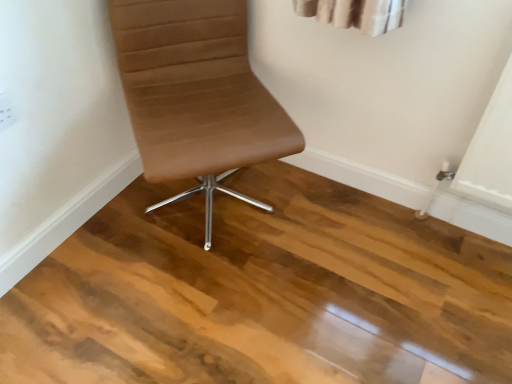
Image resolution: width=512 pixels, height=384 pixels. What do you see at coordinates (196, 94) in the screenshot?
I see `brown leather chair at center` at bounding box center [196, 94].

At what (x,y) coordinates should I click in order to perform the action: click on brown leather chair at center. Please return your answer as a coordinate pair (x, y). The image size is (512, 384). Looking at the image, I should click on (196, 94).

The width and height of the screenshot is (512, 384). In order to click on brown leather chair at center in this screenshot , I will do `click(196, 94)`.